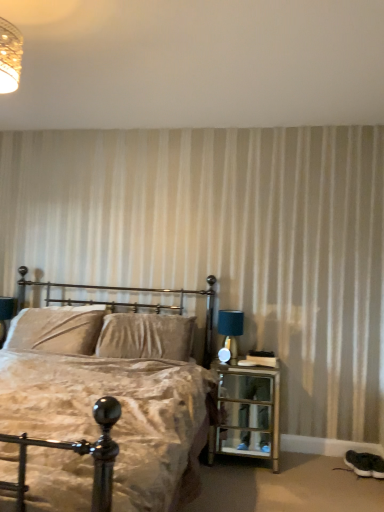
Image resolution: width=384 pixels, height=512 pixels. In order to click on free space on the front side of clear glass nightstand at right in this screenshot , I will do `click(248, 492)`.